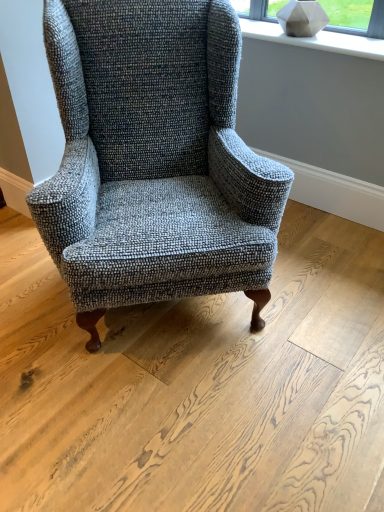
Question: From the image's perspective, is white matte stone at upper center under textured gray wingback chair at center?

Choices:
 (A) no
 (B) yes

Answer: (A)

Question: Is white matte stone at upper center bigger than textured gray wingback chair at center?

Choices:
 (A) no
 (B) yes

Answer: (A)

Question: Is white matte stone at upper center taller than textured gray wingback chair at center?

Choices:
 (A) no
 (B) yes

Answer: (A)

Question: Can you confirm if white matte stone at upper center is wider than textured gray wingback chair at center?

Choices:
 (A) no
 (B) yes

Answer: (A)

Question: Is white matte stone at upper center to the left of textured gray wingback chair at center from the viewer's perspective?

Choices:
 (A) no
 (B) yes

Answer: (A)

Question: Is textured gray wingback chair at center located within white matte stone at upper center?

Choices:
 (A) no
 (B) yes

Answer: (A)

Question: From a real-world perspective, is textured gray wingback chair at center below white matte stone at upper center?

Choices:
 (A) yes
 (B) no

Answer: (A)

Question: From the image's perspective, does textured gray wingback chair at center appear higher than white matte stone at upper center?

Choices:
 (A) yes
 (B) no

Answer: (B)

Question: Would you consider textured gray wingback chair at center to be distant from white matte stone at upper center?

Choices:
 (A) no
 (B) yes

Answer: (A)

Question: Does textured gray wingback chair at center have a lesser height compared to white matte stone at upper center?

Choices:
 (A) no
 (B) yes

Answer: (A)

Question: Is textured gray wingback chair at center outside white matte stone at upper center?

Choices:
 (A) yes
 (B) no

Answer: (A)

Question: Can you confirm if textured gray wingback chair at center is positioned to the right of white matte stone at upper center?

Choices:
 (A) yes
 (B) no

Answer: (B)

Question: Looking at their shapes, would you say textured gray wingback chair at center is wider or thinner than white matte stone at upper center?

Choices:
 (A) thin
 (B) wide

Answer: (B)